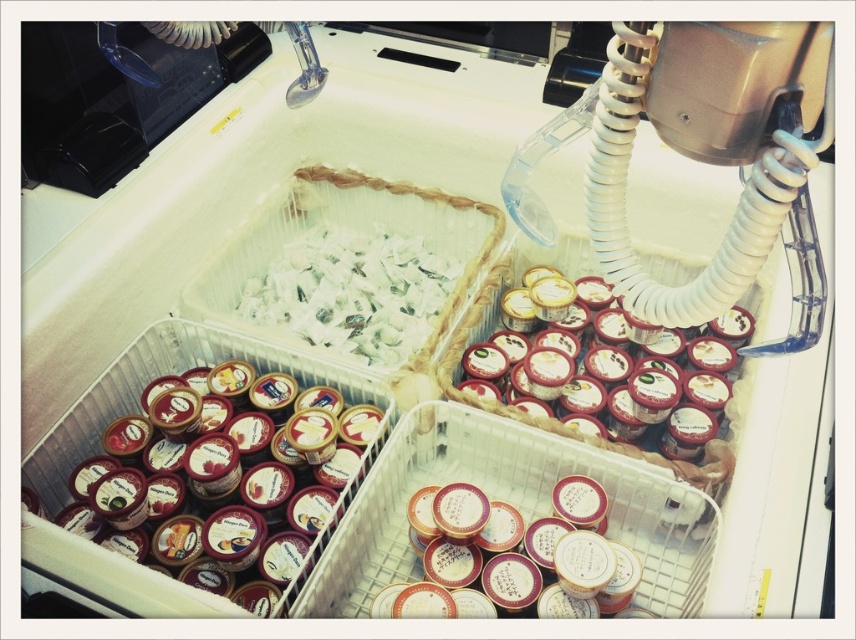
Question: Estimate the real-world distances between objects in this image. Which object is closer to the matte plastic containers at lower left?

Choices:
 (A) white paper at center
 (B) red glossy ice cream tubs at upper right

Answer: (A)

Question: Estimate the real-world distances between objects in this image. Which object is farther from the matte plastic containers at lower left?

Choices:
 (A) white paper at center
 (B) red glossy ice cream tubs at upper right

Answer: (B)

Question: Is white paper at center further to camera compared to red glossy ice cream tubs at upper right?

Choices:
 (A) yes
 (B) no

Answer: (A)

Question: Which of these objects is positioned farthest from the red glossy ice cream tubs at upper right?

Choices:
 (A) white paper at center
 (B) matte plastic containers at lower left

Answer: (B)

Question: Does white paper at center have a greater width compared to red glossy ice cream tubs at upper right?

Choices:
 (A) no
 (B) yes

Answer: (A)

Question: Can you confirm if matte plastic containers at lower left is smaller than white paper at center?

Choices:
 (A) yes
 (B) no

Answer: (B)